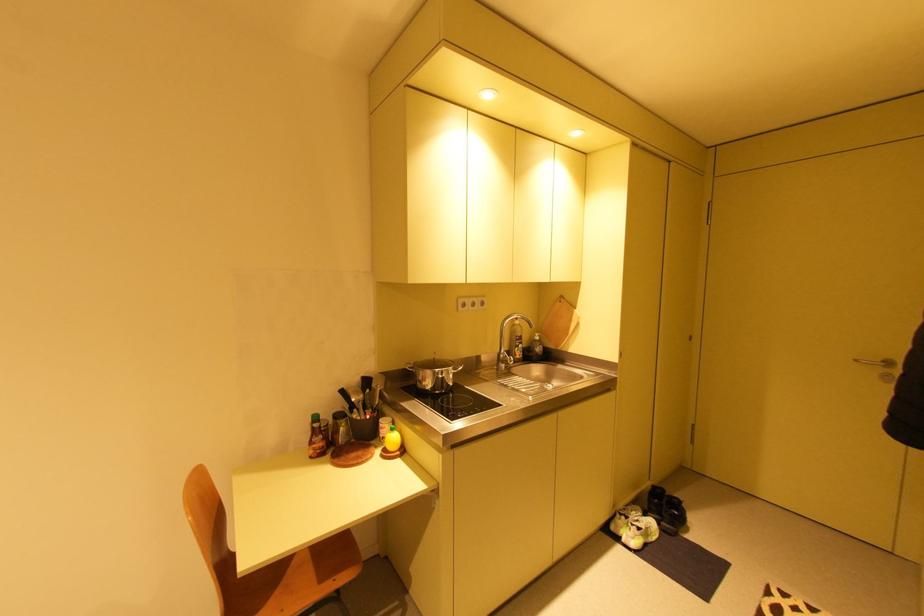
In order to click on pot lid handle in this screenshot , I will do `click(408, 368)`.